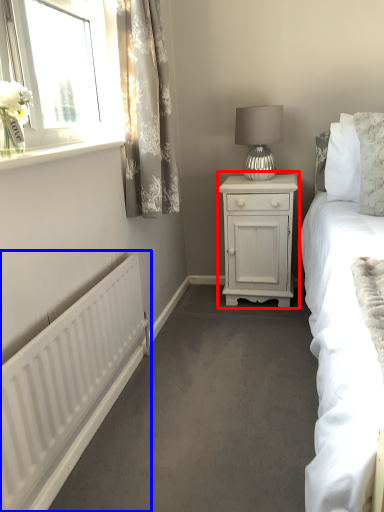
Question: Which of the following is the farthest to the observer, nightstand (highlighted by a red box) or radiator (highlighted by a blue box)?

Choices:
 (A) nightstand
 (B) radiator

Answer: (A)